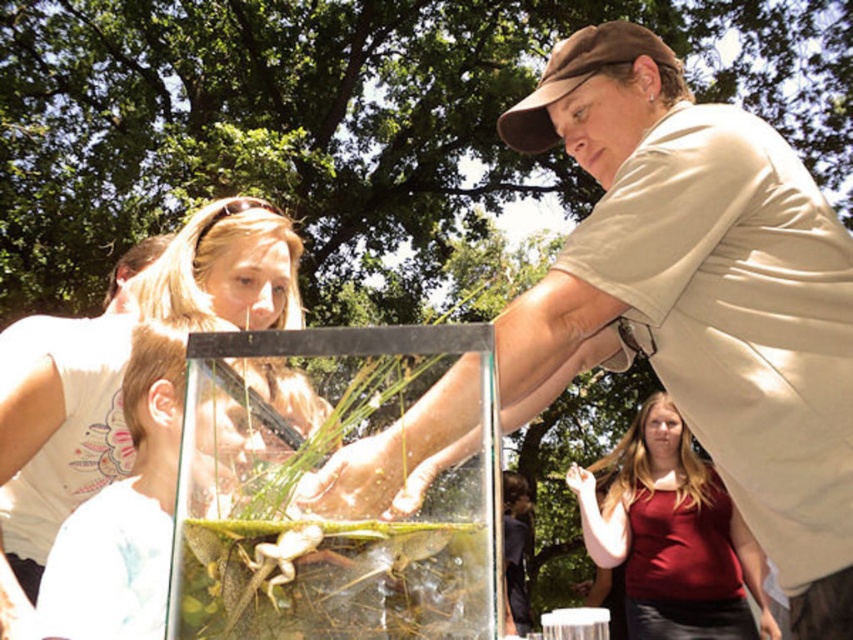
From the picture: You are a delivery person who needs to place a new 12 inch wide package between the matte beige shirt at center and the transparent glass box at center. Can the package fit in the space between them?

The distance between the matte beige shirt at center and the transparent glass box at center is 13.09 inches. Since the package is 12 inches wide, it can fit in the space between them as 12 inches is less than 13.09 inches.

You are standing at the origin point of the coordinate system in the image. The tank is located at point A. The matte beige shirt at center is at point B. If you want to move from point A to point B, in which direction should you move?

The matte beige shirt at center is located at point B with coordinates (699, 296). Since the tank is at point A, you would need to move towards point B from point A to reach the matte beige shirt at center.